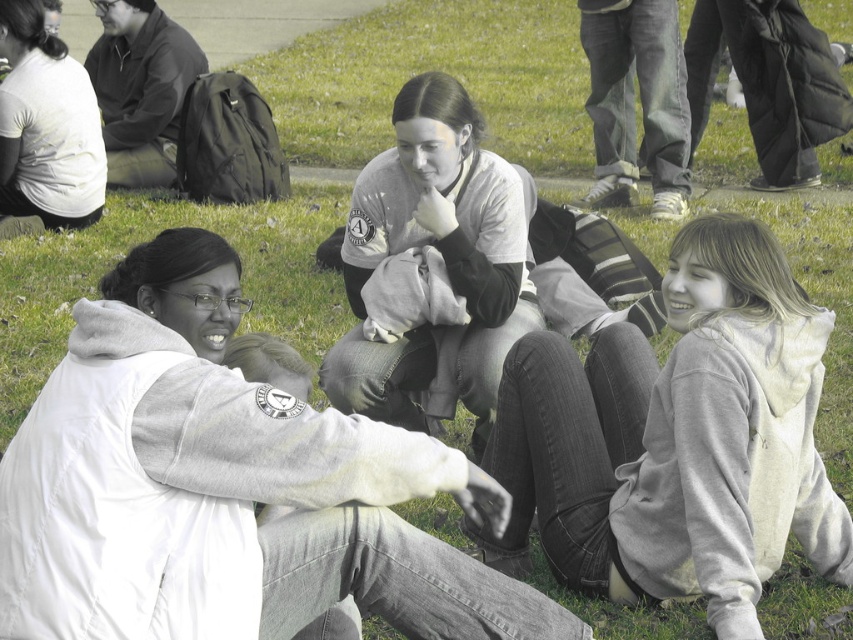
Looking at this image, which of these two, gray cotton hoodie at lower right or white cotton shirt at center, stands shorter?

gray cotton hoodie at lower right

Does gray cotton hoodie at lower right appear under white cotton shirt at center?

Correct, gray cotton hoodie at lower right is located below white cotton shirt at center.

Identify the location of gray cotton hoodie at lower right. This screenshot has height=640, width=853. (679, 438).

This screenshot has height=640, width=853. Identify the location of gray cotton hoodie at lower right. (679, 438).

Does white fleece jacket at lower left have a lesser width compared to gray cotton hoodie at lower right?

No.

Who is lower down, white fleece jacket at lower left or gray cotton hoodie at lower right?

gray cotton hoodie at lower right is below.

Locate an element on the screen. The image size is (853, 640). white fleece jacket at lower left is located at coordinates (234, 492).

Is white cotton shirt at center taller than white matte t-shirt at upper left?

Correct, white cotton shirt at center is much taller as white matte t-shirt at upper left.

Which is more to the right, white cotton shirt at center or white matte t-shirt at upper left?

white cotton shirt at center

Is point (519, 328) positioned after point (32, 177)?

That is False.

The height and width of the screenshot is (640, 853). I want to click on white cotton shirt at center, so click(x=450, y=228).